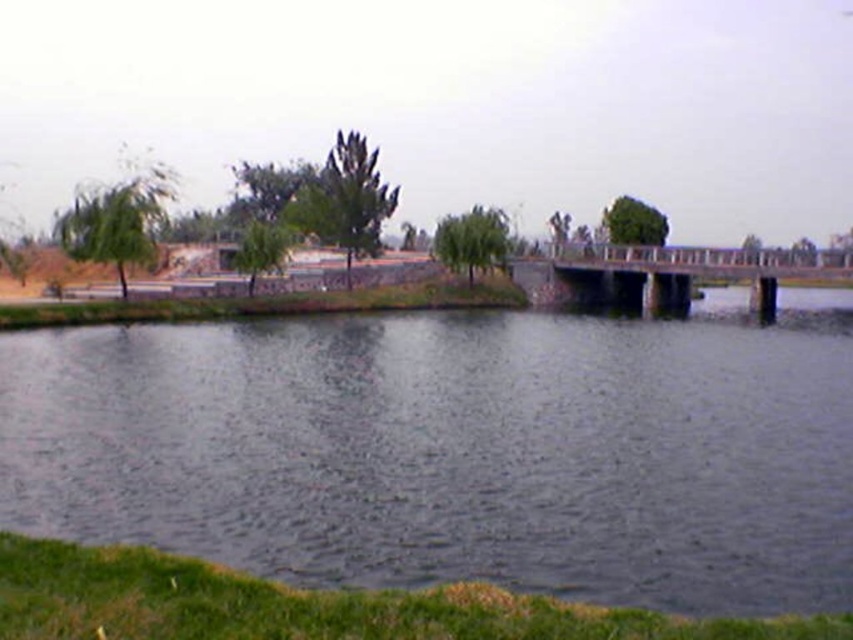
Question: Observing the image, what is the correct spatial positioning of dark blue water at center in reference to concrete bridge at center?

Choices:
 (A) left
 (B) right

Answer: (A)

Question: Does dark blue water at center appear on the right side of concrete bridge at center?

Choices:
 (A) yes
 (B) no

Answer: (B)

Question: Does dark blue water at center appear over concrete bridge at center?

Choices:
 (A) no
 (B) yes

Answer: (A)